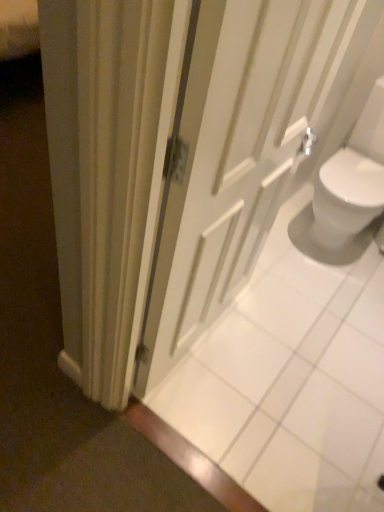
Identify the location of white glossy sink at right. (347, 193).

This screenshot has height=512, width=384. What do you see at coordinates (347, 193) in the screenshot?
I see `white glossy sink at right` at bounding box center [347, 193].

The width and height of the screenshot is (384, 512). Find the location of `white matte door at center`. white matte door at center is located at coordinates (247, 148).

What do you see at coordinates (247, 148) in the screenshot?
I see `white matte door at center` at bounding box center [247, 148].

This screenshot has width=384, height=512. I want to click on white glossy sink at right, so click(x=347, y=193).

Does white glossy sink at right appear on the left side of white matte door at center?

No, white glossy sink at right is not to the left of white matte door at center.

From the picture: Which is behind, white glossy sink at right or white matte door at center?

Positioned behind is white glossy sink at right.

Which point is more distant from viewer, (346, 207) or (186, 184)?

The point (346, 207) is behind.

From the image's perspective, is white glossy sink at right above or below white matte door at center?

Clearly, from the image's perspective, white glossy sink at right is above white matte door at center.

From a real-world perspective, which is physically above, white glossy sink at right or white matte door at center?

white matte door at center is physically above.

Which of these two, white glossy sink at right or white matte door at center, is thinner?

With smaller width is white matte door at center.

Which of these two, white glossy sink at right or white matte door at center, stands shorter?

white glossy sink at right is shorter.

Considering the sizes of objects white glossy sink at right and white matte door at center in the image provided, who is bigger, white glossy sink at right or white matte door at center?

Bigger between the two is white glossy sink at right.

Looking at this image, is white glossy sink at right inside or outside of white matte door at center?

white glossy sink at right cannot be found inside white matte door at center.

Is white glossy sink at right with white matte door at center?

white glossy sink at right and white matte door at center are not in contact.

Is white glossy sink at right aimed at white matte door at center?

Yes.

What's the angular difference between white glossy sink at right and white matte door at center's facing directions?

The angle between the facing direction of white glossy sink at right and the facing direction of white matte door at center is 91.3 degrees.

Find the location of `door above the white glossy sink at right (from a real-world perspective)`. door above the white glossy sink at right (from a real-world perspective) is located at coordinates (247, 148).

Considering the positions of objects white matte door at center and white glossy sink at right in the image provided, who is more to the right, white matte door at center or white glossy sink at right?

white glossy sink at right is more to the right.

Is the position of white matte door at center more distant than that of white glossy sink at right?

No, white matte door at center is closer to the viewer.

Considering the points (372, 41) and (353, 165), which point is behind, point (372, 41) or point (353, 165)?

The point (372, 41) is farther from the camera.

From the image's perspective, is white matte door at center beneath white glossy sink at right?

Indeed, from the image's perspective, white matte door at center is shown beneath white glossy sink at right.

Based on the photo, from a real-world perspective, who is located lower, white matte door at center or white glossy sink at right?

white glossy sink at right.

Considering the sizes of objects white matte door at center and white glossy sink at right in the image provided, who is wider, white matte door at center or white glossy sink at right?

With larger width is white glossy sink at right.

Can you confirm if white matte door at center is taller than white glossy sink at right?

Indeed, white matte door at center has a greater height compared to white glossy sink at right.

Considering the relative sizes of white matte door at center and white glossy sink at right in the image provided, is white matte door at center smaller than white glossy sink at right?

Yes.

Does white matte door at center contain white glossy sink at right?

No, white glossy sink at right is not surrounded by white matte door at center.

Can you see white matte door at center touching white glossy sink at right?

No.

Based on the photo, could you tell me if white matte door at center is facing white glossy sink at right?

No, white matte door at center is not facing towards white glossy sink at right.

Can you tell me how much white matte door at center and white glossy sink at right differ in facing direction?

91.3 degrees separate the facing orientations of white matte door at center and white glossy sink at right.

How distant is white matte door at center from white glossy sink at right?

Result: They are 31.68 inches apart.

Find the location of `door in front of the white glossy sink at right`. door in front of the white glossy sink at right is located at coordinates (247, 148).

The image size is (384, 512). I want to click on door below the white glossy sink at right (from the image's perspective), so click(247, 148).

Locate an element on the screen. The image size is (384, 512). sink behind the white matte door at center is located at coordinates (347, 193).